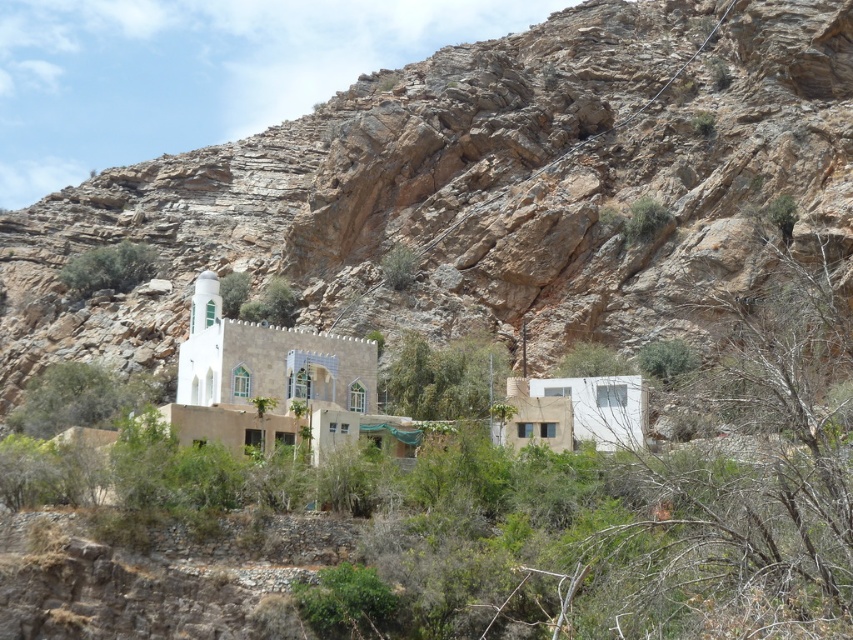
Question: Considering the real-world distances, which object is closest to the green leafy bush at lower left?

Choices:
 (A) brown rocky mountain at center
 (B) green leafy shrub at upper center
 (C) white stone church at center

Answer: (C)

Question: In this image, where is white stone church at center located relative to green leafy bush at lower left?

Choices:
 (A) left
 (B) right

Answer: (B)

Question: Can you confirm if white stone church at center is positioned to the right of green leafy shrub at upper center?

Choices:
 (A) yes
 (B) no

Answer: (A)

Question: Which of the following is the closest to the observer?

Choices:
 (A) brown rocky mountain at center
 (B) green leafy bush at lower left

Answer: (A)

Question: Which object is closer to the camera taking this photo?

Choices:
 (A) brown rocky mountain at center
 (B) green leafy bush at lower left

Answer: (A)

Question: Is brown rocky mountain at center thinner than green leafy bush at lower left?

Choices:
 (A) yes
 (B) no

Answer: (B)